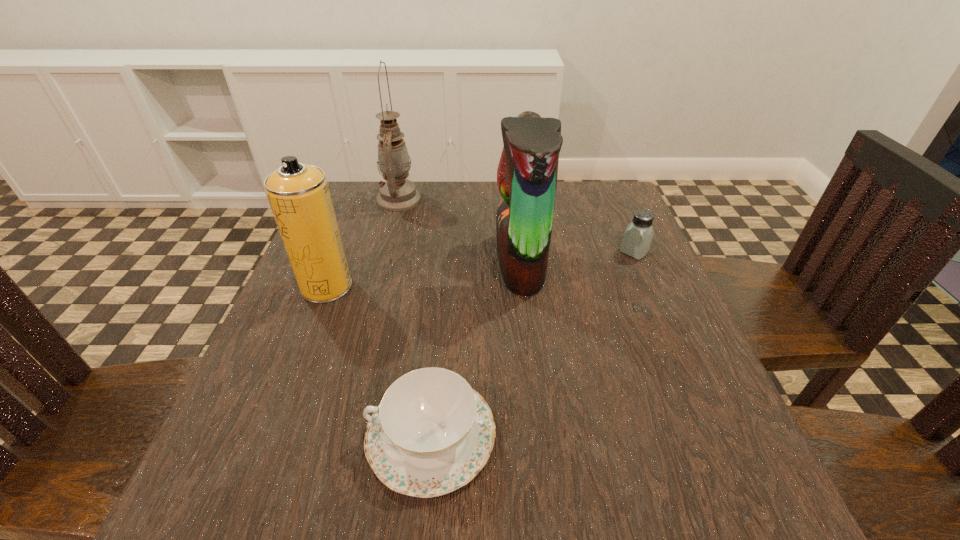
Locate an element on the screen. This screenshot has height=540, width=960. oil lamp is located at coordinates (397, 193).

What are the coordinates of `parrot` in the screenshot? It's located at (x=527, y=173).

This screenshot has height=540, width=960. Identify the location of aerosol can. (299, 196).

This screenshot has height=540, width=960. In order to click on the second shortest object in this screenshot , I will do `click(637, 238)`.

Locate an element on the screen. The image size is (960, 540). saltshaker is located at coordinates (637, 238).

Identify the location of the shortest object. (432, 433).

I want to click on the nearest object, so click(x=432, y=433).

Find the location of `free spot located on the front of the farthest object`. free spot located on the front of the farthest object is located at coordinates (384, 256).

This screenshot has width=960, height=540. Find the location of `free region located 0.240m at the face of the parrot`. free region located 0.240m at the face of the parrot is located at coordinates (387, 262).

Where is `free region located 0.070m at the face of the parrot`? The width and height of the screenshot is (960, 540). free region located 0.070m at the face of the parrot is located at coordinates (464, 262).